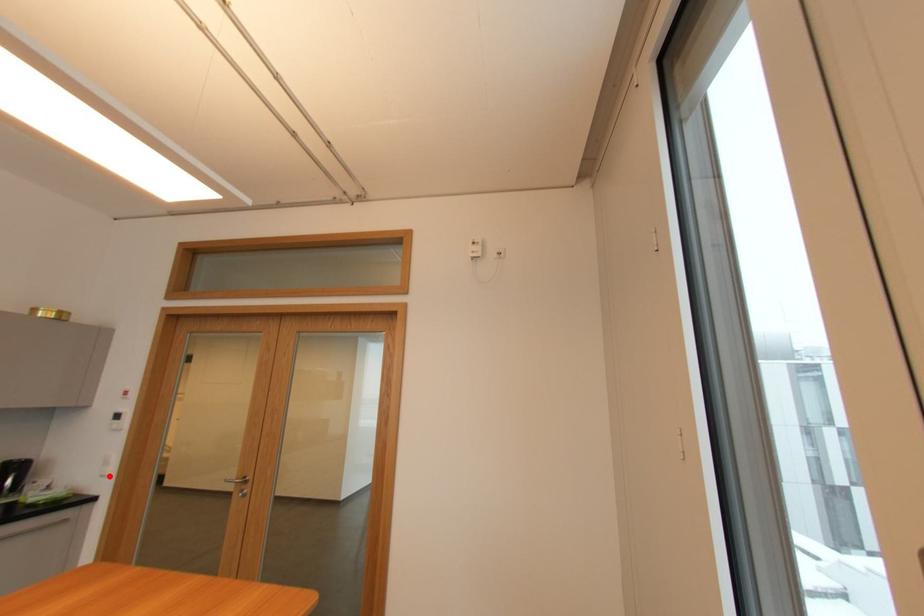
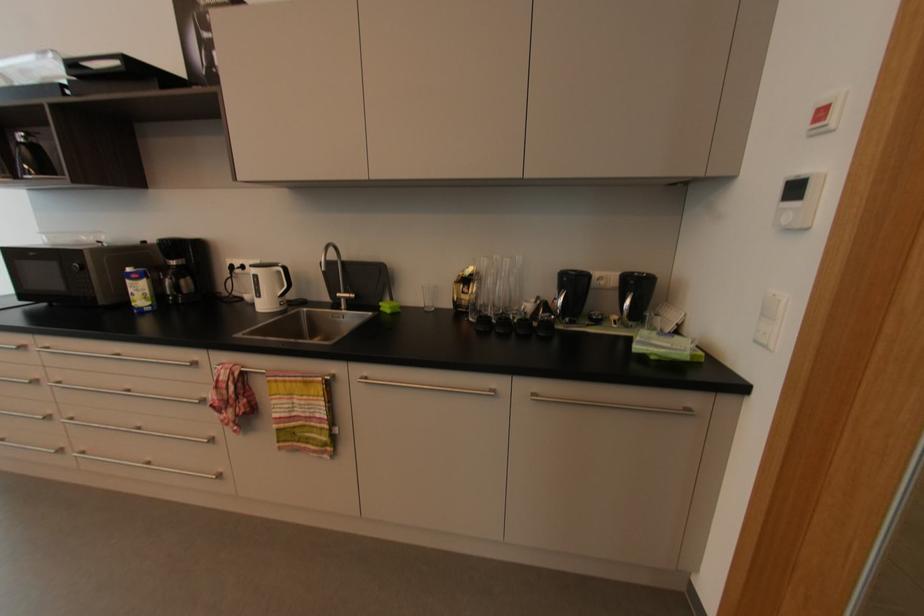
Question: I am providing you with two images of the same scene from different viewpoints. A red point is marked on the first image. Is the red point's position out of view in image 2?

Choices:
 (A) Yes
 (B) No

Answer: (B)